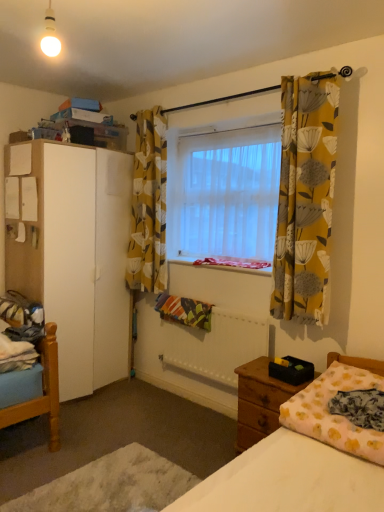
Question: Could you tell me if wooden nightstand at lower right is turned towards yellow floral fabric curtain at right, marked as the second curtain in a back-to-front arrangement?

Choices:
 (A) no
 (B) yes

Answer: (A)

Question: From the image's perspective, is wooden nightstand at lower right on yellow floral fabric curtain at right, the first curtain positioned from the front?

Choices:
 (A) no
 (B) yes

Answer: (A)

Question: Considering the relative sizes of wooden nightstand at lower right and yellow floral fabric curtain at right, marked as the second curtain in a back-to-front arrangement, in the image provided, is wooden nightstand at lower right wider than yellow floral fabric curtain at right, marked as the second curtain in a back-to-front arrangement,?

Choices:
 (A) no
 (B) yes

Answer: (B)

Question: Does wooden nightstand at lower right appear on the right side of yellow floral fabric curtain at right, which is the second curtain from left to right?

Choices:
 (A) no
 (B) yes

Answer: (A)

Question: Considering the relative sizes of wooden nightstand at lower right and yellow floral fabric curtain at right, marked as the second curtain in a back-to-front arrangement, in the image provided, is wooden nightstand at lower right bigger than yellow floral fabric curtain at right, marked as the second curtain in a back-to-front arrangement,?

Choices:
 (A) yes
 (B) no

Answer: (A)

Question: From the image's perspective, is yellow floral fabric curtain at upper center, marked as the first curtain in a back-to-front arrangement, above or below white matte cabinet at left?

Choices:
 (A) below
 (B) above

Answer: (B)

Question: Considering the positions of point (140, 124) and point (66, 365), is point (140, 124) closer or farther from the camera than point (66, 365)?

Choices:
 (A) closer
 (B) farther

Answer: (B)

Question: Is yellow floral fabric curtain at upper center, the 1th curtain positioned from the left, taller or shorter than white matte cabinet at left?

Choices:
 (A) tall
 (B) short

Answer: (B)

Question: From a real-world perspective, is yellow floral fabric curtain at upper center, the second curtain viewed from the front, physically located above or below white matte cabinet at left?

Choices:
 (A) below
 (B) above

Answer: (B)

Question: Is white glossy bulb at upper left bigger or smaller than blue cotton sheet at lower left?

Choices:
 (A) small
 (B) big

Answer: (A)

Question: From a real-world perspective, is white glossy bulb at upper left physically located above or below blue cotton sheet at lower left?

Choices:
 (A) below
 (B) above

Answer: (B)

Question: Is white glossy bulb at upper left in front of or behind blue cotton sheet at lower left in the image?

Choices:
 (A) front
 (B) behind

Answer: (A)

Question: Is white glossy bulb at upper left inside or outside of blue cotton sheet at lower left?

Choices:
 (A) inside
 (B) outside

Answer: (B)

Question: Is translucent fabric window at center inside or outside of white fabric bed at lower right?

Choices:
 (A) inside
 (B) outside

Answer: (B)

Question: Considering the positions of translucent fabric window at center and white fabric bed at lower right in the image, is translucent fabric window at center taller or shorter than white fabric bed at lower right?

Choices:
 (A) tall
 (B) short

Answer: (A)